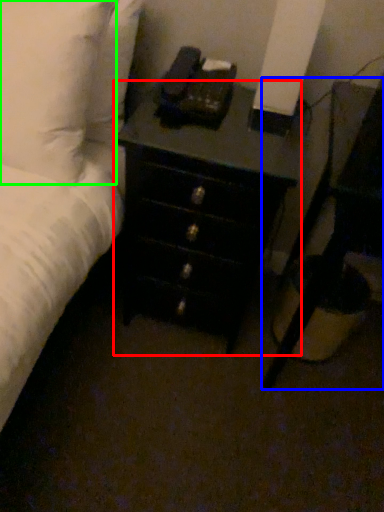
Question: Considering the real-world distances, which object is farthest from chest of drawers (highlighted by a red box)? nightstand (highlighted by a blue box) or pillow (highlighted by a green box)?

Choices:
 (A) nightstand
 (B) pillow

Answer: (B)